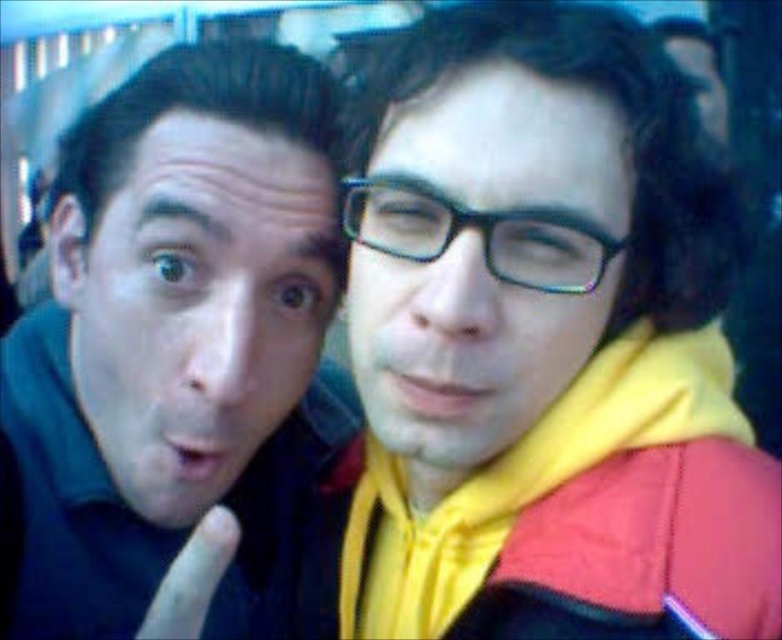
You are a photographer trying to capture a clear photo of the matte black shirt at left and the black plastic glasses at center. The camera has a depth of field that can focus on objects within 10 inches. Will both objects be in focus?

The matte black shirt at left is 9.56 inches away from the black plastic glasses at center. Since the distance between them is within the camera s 10 inch depth of field, both objects will be in focus.

Looking at this image, you are standing in a public transportation vehicle and want to take a selfie with your friend. You notice a point at coordinates point (223, 44) that is 26.43 inches away from you. If your phone camera has a minimum focus distance of 24 inches, will you be able to focus on that point clearly?

The point at point (223, 44) is 26.43 inches away from the viewer. Since the minimum focus distance of the phone camera is 24 inches, which is less than 26.43 inches, the camera should be able to focus on that point clearly.